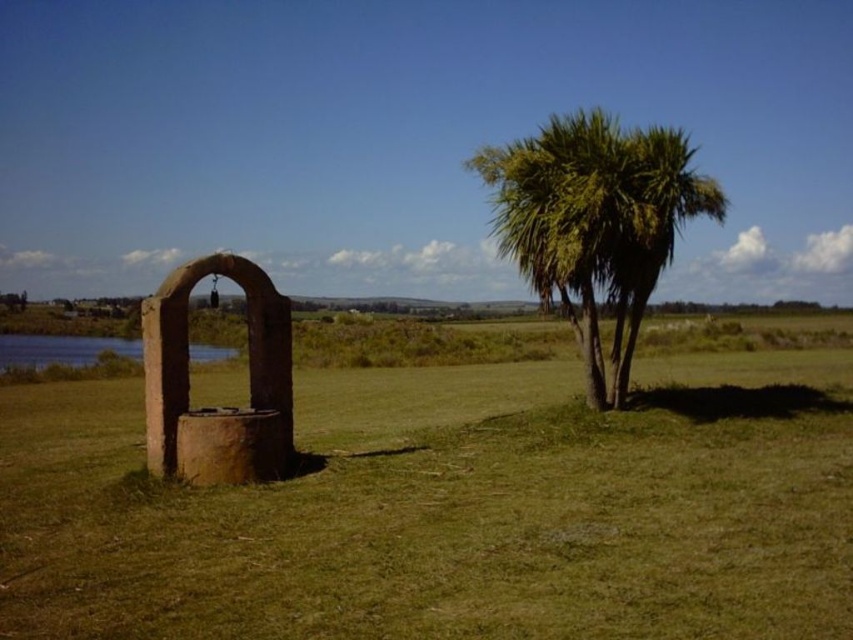
Question: Can you confirm if green grass at lower left is positioned below green leafy palm at right?

Choices:
 (A) yes
 (B) no

Answer: (A)

Question: Does green grass at lower left lie behind green leafy palm at right?

Choices:
 (A) yes
 (B) no

Answer: (B)

Question: Which object appears farthest from the camera in this image?

Choices:
 (A) green leafy palm at right
 (B) green grass at lower left

Answer: (A)

Question: Among these objects, which one is nearest to the camera?

Choices:
 (A) green grass at lower left
 (B) green leafy palm at right

Answer: (A)

Question: Among these points, which one is nearest to the camera?

Choices:
 (A) (527, 214)
 (B) (474, 458)

Answer: (B)

Question: Does green grass at lower left have a larger size compared to green leafy palm at right?

Choices:
 (A) yes
 (B) no

Answer: (B)